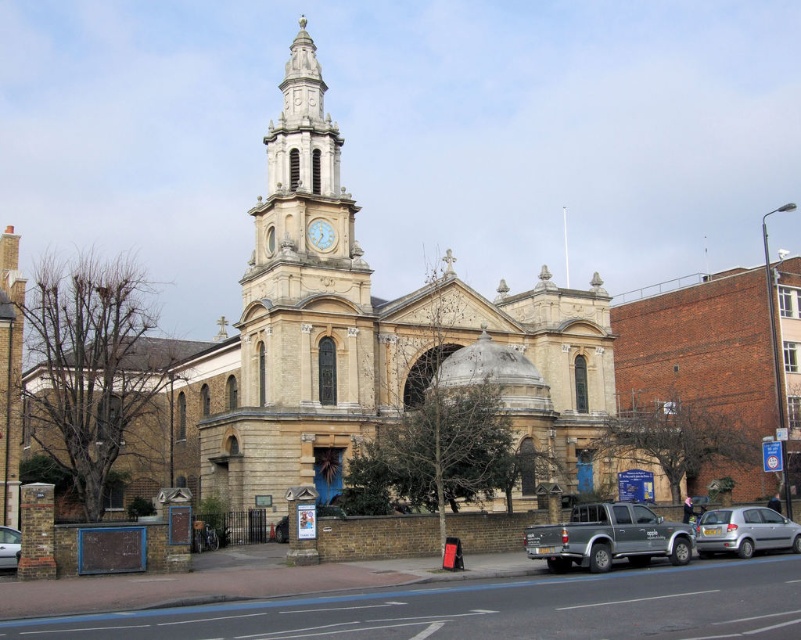
Is matte gray pickup truck at lower center closer to camera compared to silver metallic hatchback at lower right?

Yes.

Looking at this image, is matte gray pickup truck at lower center bigger than silver metallic hatchback at lower right?

Yes, matte gray pickup truck at lower center is bigger than silver metallic hatchback at lower right.

Is point (630, 552) behind point (723, 536)?

That is False.

Where is `matte gray pickup truck at lower center`? This screenshot has height=640, width=801. matte gray pickup truck at lower center is located at coordinates (608, 538).

Between silver metallic car at lower left and white stone clock at center, which one appears on the right side from the viewer's perspective?

From the viewer's perspective, white stone clock at center appears more on the right side.

Can you confirm if silver metallic car at lower left is positioned above white stone clock at center?

No, silver metallic car at lower left is not above white stone clock at center.

Does point (11, 561) come behind point (325, 244)?

No, (11, 561) is closer to viewer.

I want to click on silver metallic car at lower left, so click(7, 547).

What do you see at coordinates (745, 531) in the screenshot? I see `silver metallic hatchback at lower right` at bounding box center [745, 531].

Does point (791, 532) come in front of point (312, 234)?

Yes, it is.

The image size is (801, 640). What do you see at coordinates (745, 531) in the screenshot?
I see `silver metallic hatchback at lower right` at bounding box center [745, 531].

I want to click on silver metallic hatchback at lower right, so click(x=745, y=531).